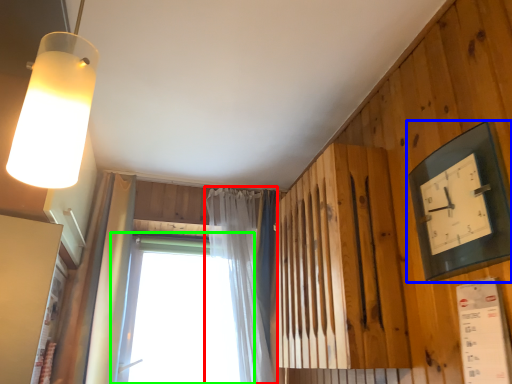
Question: Which object is the farthest from curtain (highlighted by a red box)? Choose among these: clock (highlighted by a blue box) or window (highlighted by a green box).

Choices:
 (A) clock
 (B) window

Answer: (A)